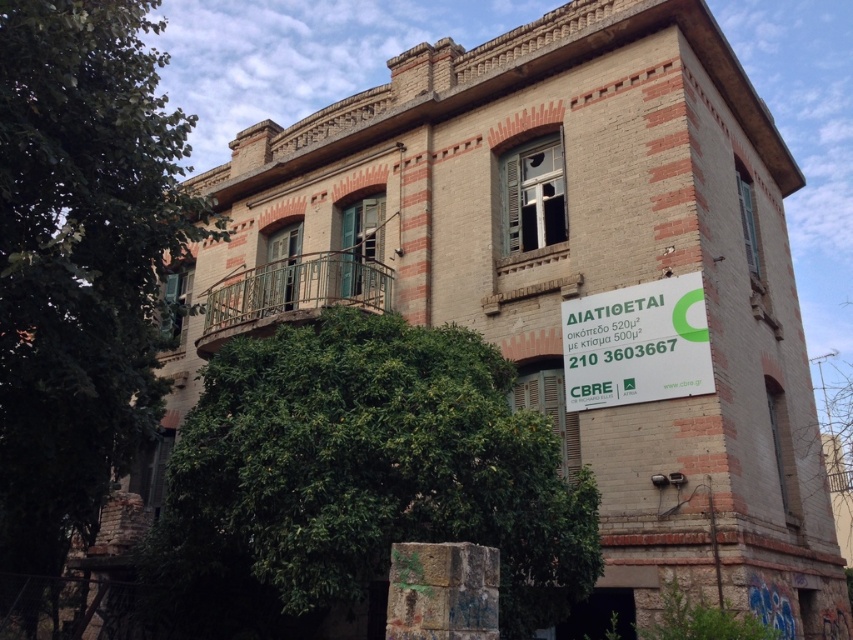
Question: Which of the following is the farthest from the observer?

Choices:
 (A) (144, 244)
 (B) (645, 324)
 (C) (543, 477)

Answer: (B)

Question: Which of the following is the closest to the observer?

Choices:
 (A) (577, 406)
 (B) (9, 145)
 (C) (213, 513)

Answer: (B)

Question: From the image, what is the correct spatial relationship of green leafy tree at left in relation to green paper sign at center?

Choices:
 (A) above
 (B) below

Answer: (A)

Question: Estimate the real-world distances between objects in this image. Which object is farther from the green leafy tree at center?

Choices:
 (A) green paper sign at center
 (B) green leafy tree at left

Answer: (A)

Question: Can you confirm if green leafy tree at left is positioned below green paper sign at center?

Choices:
 (A) no
 (B) yes

Answer: (A)

Question: Is the position of green leafy tree at left less distant than that of green paper sign at center?

Choices:
 (A) yes
 (B) no

Answer: (A)